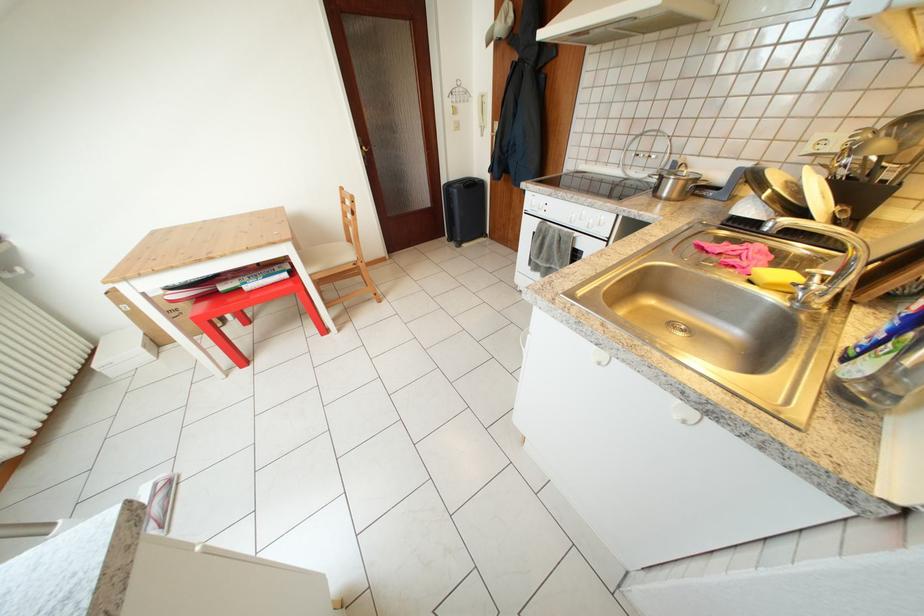
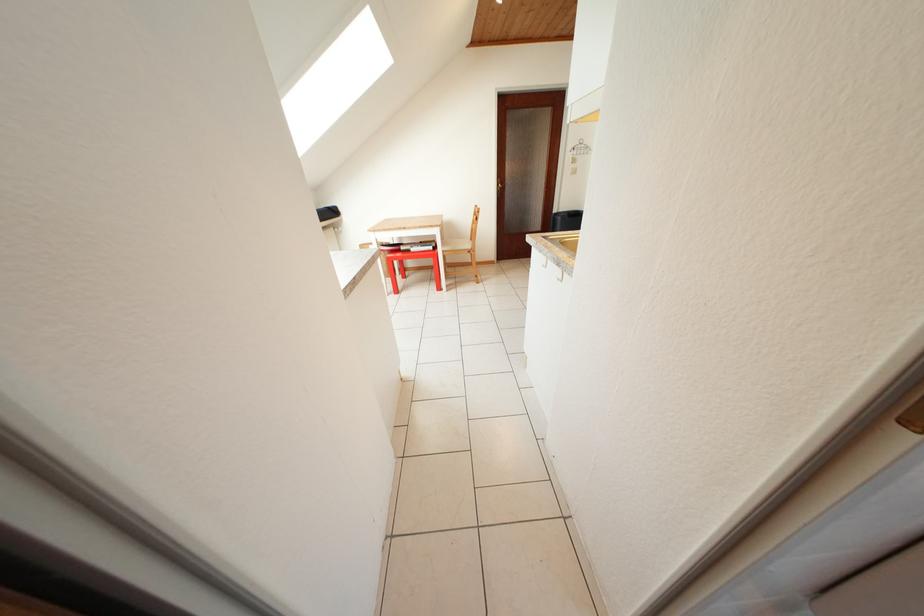
The point at (322, 275) is marked in the first image. Where is the corresponding point in the second image?

(454, 254)